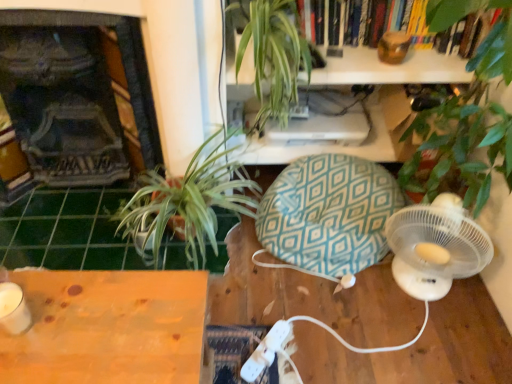
This screenshot has height=384, width=512. What are the coordinates of `free spot in front of white plastic fan at lower right` in the screenshot? It's located at (422, 344).